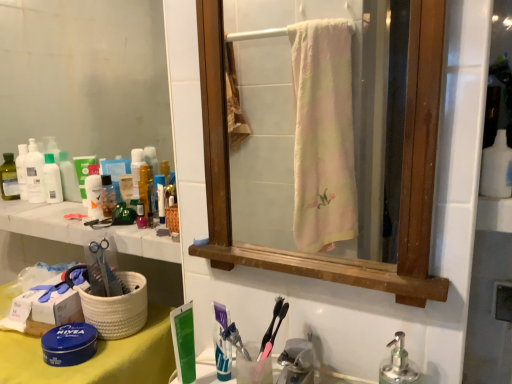
Question: Is white marble counter at upper left positioned with its back to white matte bottle at upper right?

Choices:
 (A) yes
 (B) no

Answer: (B)

Question: From a real-world perspective, is white marble counter at upper left over white matte bottle at upper right?

Choices:
 (A) no
 (B) yes

Answer: (A)

Question: Does white marble counter at upper left appear on the left side of white matte bottle at upper right?

Choices:
 (A) no
 (B) yes

Answer: (B)

Question: From a real-world perspective, does white marble counter at upper left sit lower than white matte bottle at upper right?

Choices:
 (A) yes
 (B) no

Answer: (A)

Question: Is white marble counter at upper left aimed at white matte bottle at upper right?

Choices:
 (A) yes
 (B) no

Answer: (B)

Question: In the image, is translucent plastic bottle at upper left, the 1th mouthwash positioned from the front, positioned in front of or behind white marble counter at upper left?

Choices:
 (A) front
 (B) behind

Answer: (B)

Question: In the image, is translucent plastic bottle at upper left, placed as the first mouthwash when sorted from right to left, on the left side or the right side of white marble counter at upper left?

Choices:
 (A) right
 (B) left

Answer: (A)

Question: From their relative heights in the image, would you say translucent plastic bottle at upper left, which ranks as the 2th mouthwash in left-to-right order, is taller or shorter than white marble counter at upper left?

Choices:
 (A) tall
 (B) short

Answer: (A)

Question: Based on their sizes in the image, would you say translucent plastic bottle at upper left, acting as the 2th mouthwash starting from the back, is bigger or smaller than white marble counter at upper left?

Choices:
 (A) small
 (B) big

Answer: (A)

Question: Considering their positions, is silver metallic soap dispenser at lower right located in front of or behind translucent plastic bottles at left, the first toiletry positioned from the left?

Choices:
 (A) behind
 (B) front

Answer: (B)

Question: In terms of width, does silver metallic soap dispenser at lower right look wider or thinner when compared to translucent plastic bottles at left, which ranks as the second toiletry in right-to-left order?

Choices:
 (A) wide
 (B) thin

Answer: (B)

Question: From a real-world perspective, relative to translucent plastic bottles at left, the first toiletry positioned from the left, is silver metallic soap dispenser at lower right vertically above or below?

Choices:
 (A) above
 (B) below

Answer: (B)

Question: Does point (384, 379) appear closer or farther from the camera than point (12, 153)?

Choices:
 (A) closer
 (B) farther

Answer: (A)

Question: Would you say matte white lotion at left, the second toiletry viewed from the left, is to the left or to the right of translucent plastic mouthwash at left, which ranks as the second mouthwash in front-to-back order, in the picture?

Choices:
 (A) left
 (B) right

Answer: (B)

Question: In terms of height, does matte white lotion at left, marked as the first toiletry in a right-to-left arrangement, look taller or shorter compared to translucent plastic mouthwash at left, which is the first mouthwash from left to right?

Choices:
 (A) short
 (B) tall

Answer: (A)